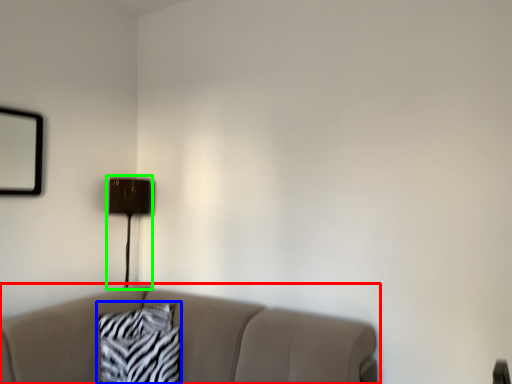
Question: Which object is positioned closest to studio couch (highlighted by a red box)? Select from pillow (highlighted by a blue box) and table lamp (highlighted by a green box).

Choices:
 (A) pillow
 (B) table lamp

Answer: (A)